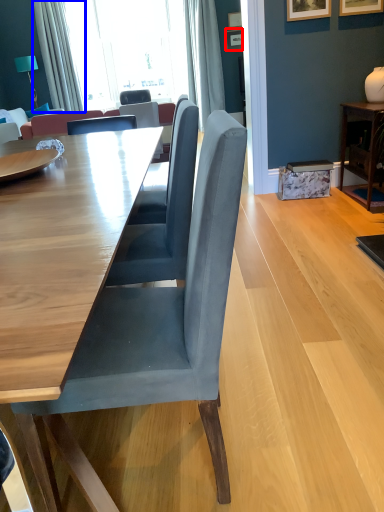
Question: Which point is closer to the camera, picture frame (highlighted by a red box) or curtain (highlighted by a blue box)?

Choices:
 (A) picture frame
 (B) curtain

Answer: (B)